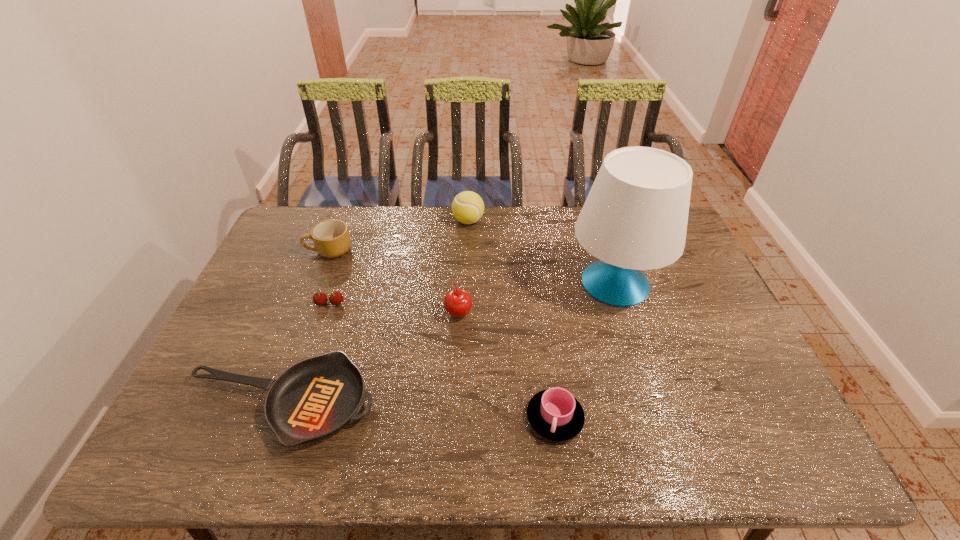
I want to click on table lamp, so click(635, 217).

Where is `the tallest object`? The width and height of the screenshot is (960, 540). the tallest object is located at coordinates (635, 217).

Image resolution: width=960 pixels, height=540 pixels. Identify the location of the farthest object. (467, 207).

This screenshot has height=540, width=960. I want to click on the left cherry, so click(x=335, y=298).

Where is `the right cherry`? the right cherry is located at coordinates (458, 302).

The image size is (960, 540). I want to click on the third shortest object, so click(x=331, y=238).

You are a GUI agent. You are given a task and a screenshot of the screen. Output one action in this format:
    pyautogui.click(x=<x>, y=<y>)
    Task: Click on the second shortest object
    
    Given the screenshot: What is the action you would take?
    pyautogui.click(x=555, y=414)

Identify the location of cup. (555, 414).

Locate an element on the screen. Image resolution: width=960 pixels, height=540 pixels. the shortest object is located at coordinates (316, 397).

The image size is (960, 540). I want to click on vacant space situated 0.060m on the front-facing side of the tallest object, so click(x=547, y=283).